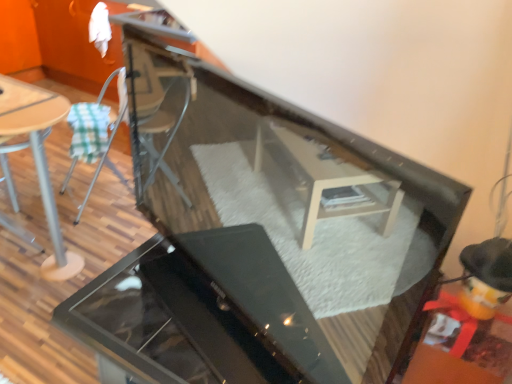
What is the approximate width of glossy black grill at center?

glossy black grill at center is 20.55 inches wide.

You are a GUI agent. You are given a task and a screenshot of the screen. Output one action in this format:
    pyautogui.click(x=<x>, y=<y>)
    Task: Click on the wooden table top at left
    This screenshot has width=512, height=384.
    Given the screenshot: What is the action you would take?
    pyautogui.click(x=28, y=107)

Image resolution: width=512 pixels, height=384 pixels. What do you see at coordinates (101, 161) in the screenshot?
I see `metallic silver chair at left` at bounding box center [101, 161].

Where is `wooden table at left`? wooden table at left is located at coordinates (39, 158).

Is point (104, 151) positioned before point (48, 109)?

No, it is behind (48, 109).

Considering the relative sizes of metallic silver chair at left and wooden table at left in the image provided, is metallic silver chair at left taller than wooden table at left?

Yes.

From the picture: From the image's perspective, which one is positioned lower, metallic silver chair at left or wooden table at left?

wooden table at left appears lower in the image.

Find the location of a particular element. The height and width of the screenshot is (384, 512). table that is in front of the metallic silver chair at left is located at coordinates (39, 158).

Who is smaller, wooden table at left or metallic silver chair at left?

Smaller between the two is metallic silver chair at left.

Is wooden table at left in contact with metallic silver chair at left?

No, wooden table at left is not touching metallic silver chair at left.

From a real-world perspective, is wooden table at left beneath metallic silver chair at left?

Yes, from a real-world perspective, wooden table at left is below metallic silver chair at left.

Considering the positions of points (40, 125) and (68, 257), is point (40, 125) farther from camera compared to point (68, 257)?

No, (40, 125) is closer to viewer.

From a real-world perspective, does wooden table top at left stand above wooden table at left?

Indeed, from a real-world perspective, wooden table top at left stands above wooden table at left.

How distant is wooden table top at left from wooden table at left?

15.19 centimeters.

Does wooden table at left come in front of wooden table top at left?

Yes, wooden table at left is closer to the viewer.

From the image's perspective, relative to wooden table top at left, is wooden table at left above or below?

Based on their image positions, wooden table at left is located beneath wooden table top at left.

Based on their positions, is wooden table at left located to the left or right of wooden table top at left?

In the image, wooden table at left appears on the left side of wooden table top at left.

How many degrees apart are the facing directions of wooden table at left and wooden table top at left?

The facing directions of wooden table at left and wooden table top at left are 1.75 degrees apart.

Between metallic silver chair at left and wooden table top at left, which one is positioned in front?

wooden table top at left is closer to the camera.

Would you say metallic silver chair at left is inside or outside wooden table top at left?

metallic silver chair at left is outside wooden table top at left.

Does metallic silver chair at left turn towards wooden table top at left?

Yes, metallic silver chair at left is aimed at wooden table top at left.

From a real-world perspective, which object rests below the other?

metallic silver chair at left.

In the scene shown: Does glossy black grill at center have a larger size compared to wooden table at left?

No.

Is wooden table at left surrounded by glossy black grill at center?

No.

Is glossy black grill at center positioned before wooden table at left?

Yes.

From a real-world perspective, relative to wooden table at left, is glossy black grill at center vertically above or below?

glossy black grill at center is below wooden table at left.

In the scene shown: Which is more to the left, metallic silver chair at left or glossy black grill at center?

metallic silver chair at left is more to the left.

Is metallic silver chair at left not near glossy black grill at center?

That's right, there is a large distance between metallic silver chair at left and glossy black grill at center.

Considering the positions of point (69, 169) and point (260, 287), is point (69, 169) closer or farther from the camera than point (260, 287)?

Point (69, 169).

Is metallic silver chair at left bigger or smaller than glossy black grill at center?

Considering their sizes, metallic silver chair at left takes up less space than glossy black grill at center.

The width and height of the screenshot is (512, 384). Find the location of `chair located above the wooden table at left (from a real-world perspective)`. chair located above the wooden table at left (from a real-world perspective) is located at coordinates (101, 161).

Locate an element on the screen. Image resolution: width=512 pixels, height=384 pixels. chair above the wooden table at left (from the image's perspective) is located at coordinates (101, 161).

When comparing their distances from glossy black grill at center, does metallic silver chair at left or wooden table at left seem closer?

Based on the image, wooden table at left appears to be nearer to glossy black grill at center.

Considering their positions, is glossy black grill at center positioned further to wooden table at left than wooden table top at left?

glossy black grill at center lies further to wooden table at left than the other object.

Based on their spatial positions, is wooden table at left or glossy black grill at center closer to wooden table top at left?

The object closer to wooden table top at left is wooden table at left.

Estimate the real-world distances between objects in this image. Which object is further from wooden table at left, metallic silver chair at left or glossy black grill at center?

glossy black grill at center is positioned further to the anchor wooden table at left.

Looking at the image, which one is located closer to glossy black grill at center, wooden table at left or metallic silver chair at left?

The object closer to glossy black grill at center is wooden table at left.

Which object lies nearer to the anchor point glossy black grill at center, wooden table top at left or wooden table at left?

wooden table at left is positioned closer to the anchor glossy black grill at center.

Estimate the real-world distances between objects in this image. Which object is further from metallic silver chair at left, glossy black grill at center or wooden table at left?

glossy black grill at center is further to metallic silver chair at left.

Based on their spatial positions, is glossy black grill at center or wooden table top at left further from metallic silver chair at left?

The object further to metallic silver chair at left is glossy black grill at center.

Where is `table top between wooden table at left and metallic silver chair at left from front to back`? The width and height of the screenshot is (512, 384). table top between wooden table at left and metallic silver chair at left from front to back is located at coordinates (28, 107).

This screenshot has height=384, width=512. Find the location of `chair between wooden table top at left and glossy black grill at center in the vertical direction`. chair between wooden table top at left and glossy black grill at center in the vertical direction is located at coordinates (101, 161).

This screenshot has height=384, width=512. Find the location of `chair situated between wooden table at left and glossy black grill at center from left to right`. chair situated between wooden table at left and glossy black grill at center from left to right is located at coordinates (101, 161).

Find the location of a particular element. table top between wooden table at left and glossy black grill at center is located at coordinates (28, 107).